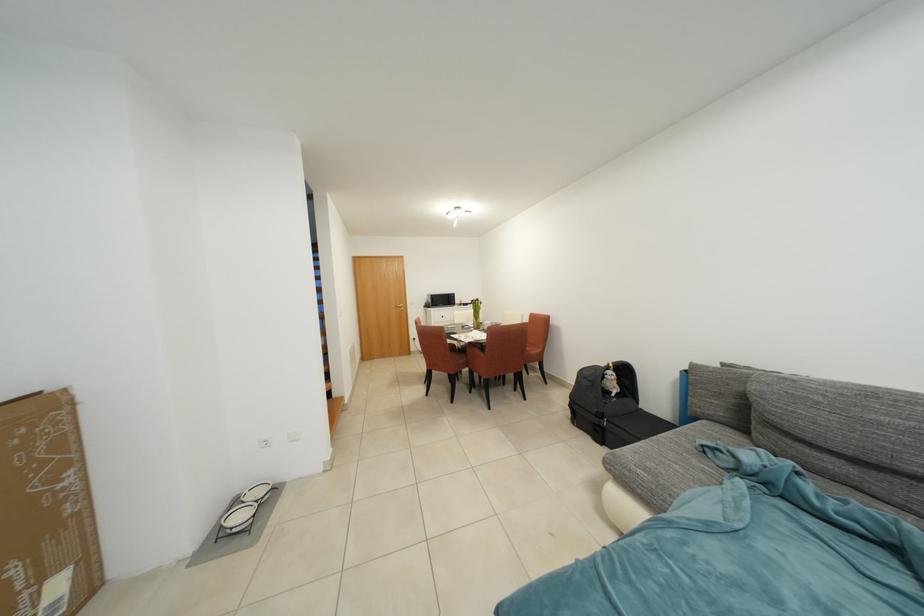
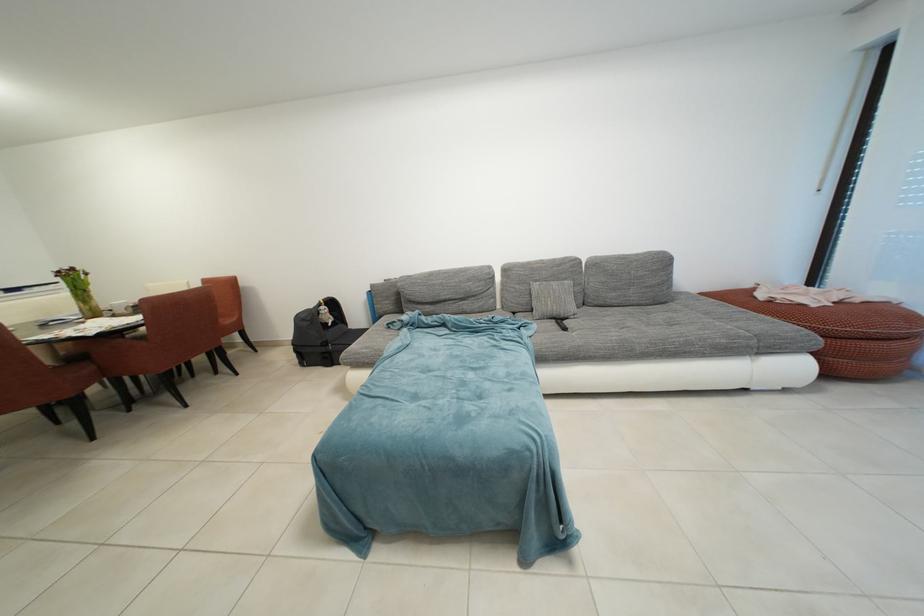
Find the pixel in the second image that matches (615,371) in the first image.

(329, 309)